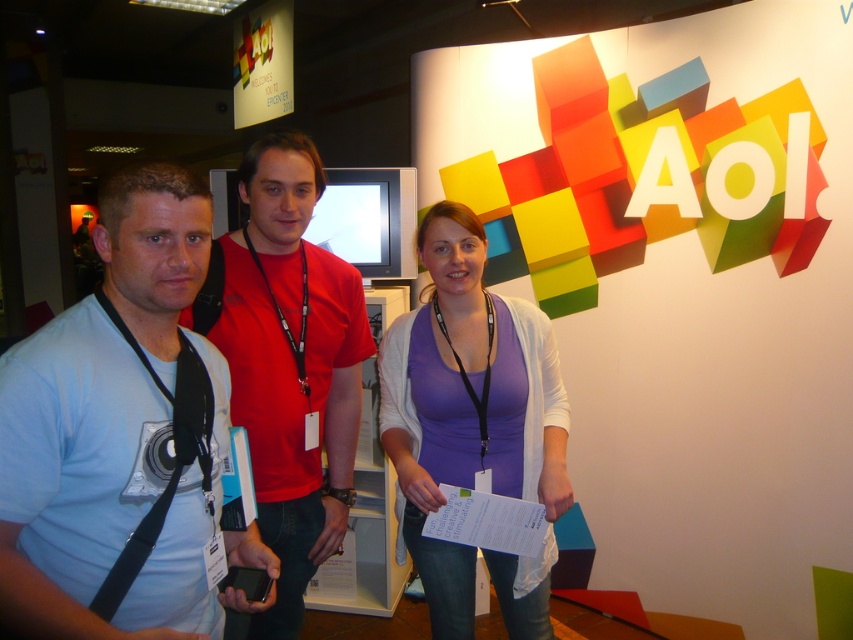
You are at the AOL event and need to find the shortest path to the registration desk. There are two points marked in the image. The first point is at coordinates point(79,442) and the second point is at coordinates point(506,332). Which point should you head towards to reach the registration desk faster?

Point(79,442) is in front of point(506,332), so you should head towards point(79,442) to reach the registration desk faster.